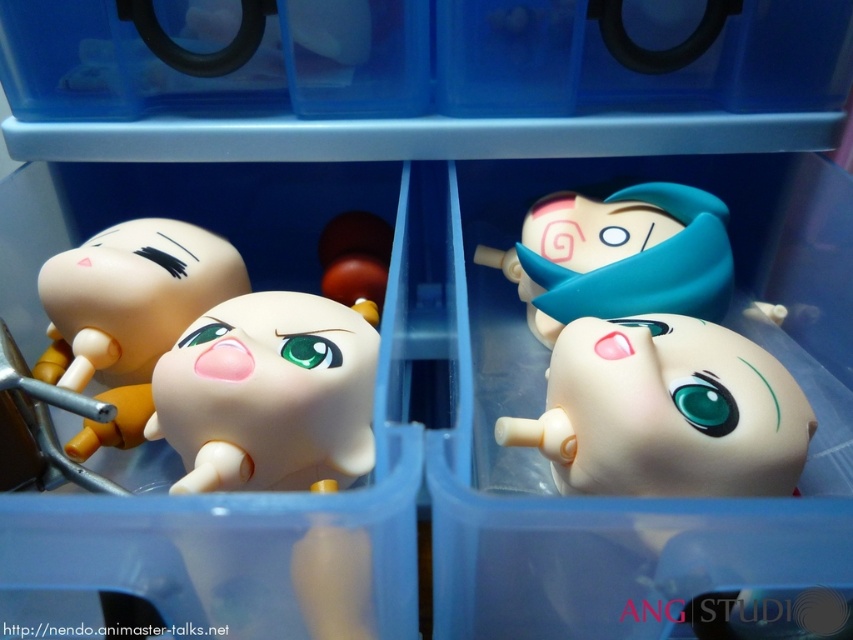
Describe the element at coordinates (128, 314) in the screenshot. Image resolution: width=853 pixels, height=640 pixels. I see `matte plastic toy at center` at that location.

From the picture: Which is above, matte plastic toy at center or matte white figure at upper right?

matte white figure at upper right is higher up.

Measure the distance between point (108, 365) and camera.

Point (108, 365) and camera are 29.95 inches apart.

Locate an element on the screen. The height and width of the screenshot is (640, 853). matte plastic toy at center is located at coordinates pyautogui.click(x=128, y=314).

Is white glossy figurine at center shorter than matte white figure at upper right?

Yes.

Is point (196, 461) more distant than point (618, 312)?

No.

At what (x,y) coordinates should I click in order to perform the action: click on white glossy figurine at center. Please return your answer as a coordinate pair (x, y). The height and width of the screenshot is (640, 853). Looking at the image, I should click on (268, 394).

Can you confirm if white glossy figurine at center is positioned above matte plastic toy at center?

→ No, white glossy figurine at center is not above matte plastic toy at center.

Which is behind, point (233, 355) or point (178, 221)?

The point (178, 221) is behind.

The height and width of the screenshot is (640, 853). Find the location of `white glossy figurine at center`. white glossy figurine at center is located at coordinates (268, 394).